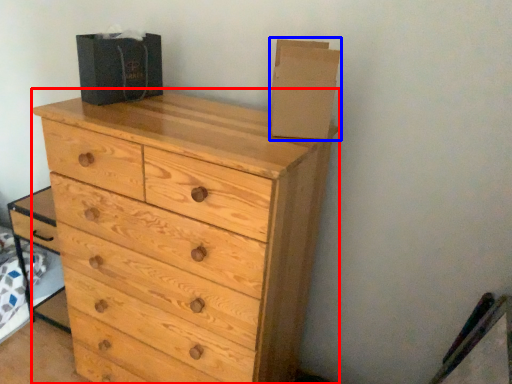
Question: Which object is further to the camera taking this photo, chest of drawers (highlighted by a red box) or cardboard box (highlighted by a blue box)?

Choices:
 (A) chest of drawers
 (B) cardboard box

Answer: (B)